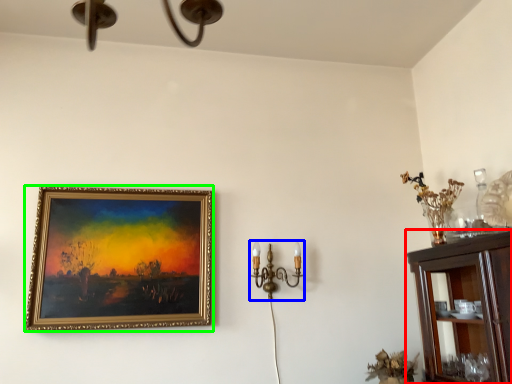
Question: Which object is positioned farthest from cabinetry (highlighted by a red box)? Select from candle holder (highlighted by a blue box) and picture frame (highlighted by a green box).

Choices:
 (A) candle holder
 (B) picture frame

Answer: (B)